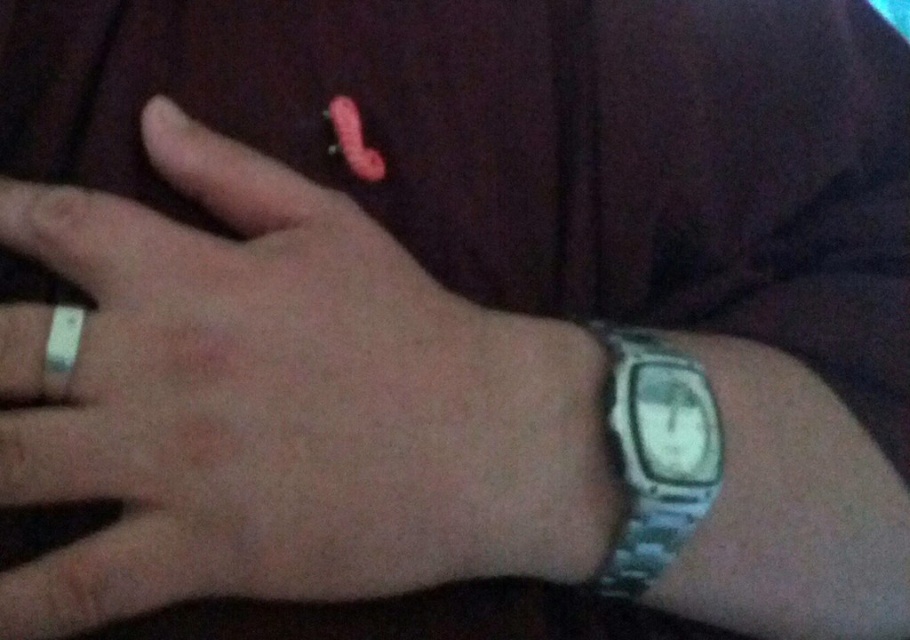
From the picture: Is metallic watch at right taller than silver metallic ring at left?

Yes, metallic watch at right is taller than silver metallic ring at left.

Who is more distant from viewer, (236,589) or (56,353)?

Point (236,589)

You are a GUI agent. You are given a task and a screenshot of the screen. Output one action in this format:
    pyautogui.click(x=<x>, y=<y>)
    Task: Click on the metallic watch at right
    Image resolution: width=910 pixels, height=640 pixels.
    Given the screenshot: What is the action you would take?
    pyautogui.click(x=287, y=404)

Is point (458, 440) positioned after point (615, 419)?

No.

Which is more to the right, metallic watch at right or metallic silver watch at right?

metallic silver watch at right is more to the right.

Where is `metallic watch at right`? This screenshot has width=910, height=640. metallic watch at right is located at coordinates (287, 404).

Where is `metallic watch at right`? Image resolution: width=910 pixels, height=640 pixels. metallic watch at right is located at coordinates click(287, 404).

Is metallic silver watch at right below silver metallic ring at left?

Indeed, metallic silver watch at right is positioned under silver metallic ring at left.

Between metallic silver watch at right and silver metallic ring at left, which one appears on the right side from the viewer's perspective?

metallic silver watch at right

This screenshot has width=910, height=640. What do you see at coordinates (655, 452) in the screenshot? I see `metallic silver watch at right` at bounding box center [655, 452].

Where is `metallic silver watch at right`? This screenshot has width=910, height=640. metallic silver watch at right is located at coordinates (655, 452).